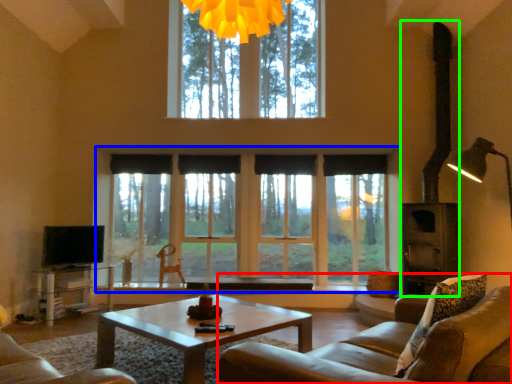
Question: Which is nearer to the studio couch (highlighted by a red box)? window (highlighted by a blue box) or fireplace (highlighted by a green box).

Choices:
 (A) window
 (B) fireplace

Answer: (B)